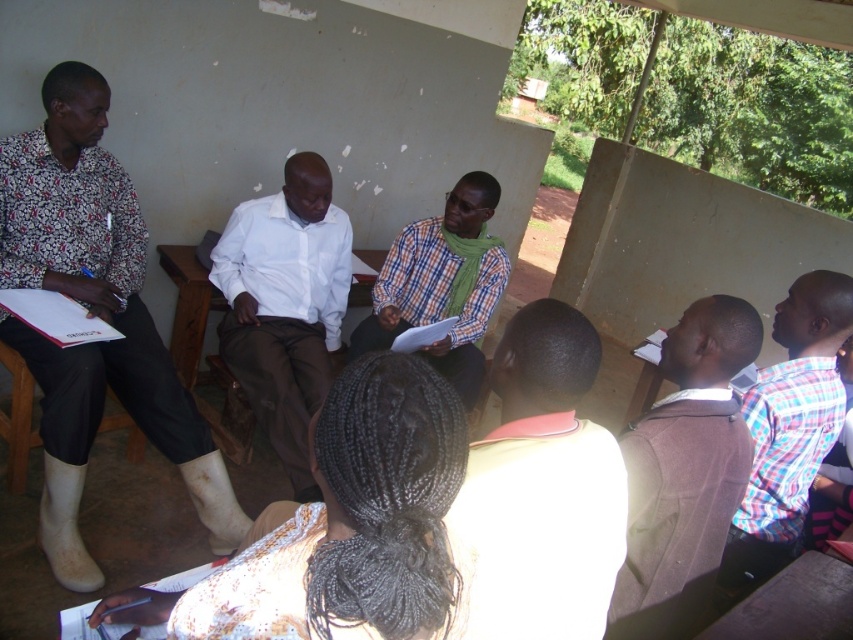
You are organizing a clothing donation drive and need to decide which items will fit into a narrow storage box. Based on the image, which item between the brown woolen sweater at upper right and the plaid fabric shirt at right is more likely to fit into the box due to its size?

The brown woolen sweater at upper right is thinner than the plaid fabric shirt at right, so it is more likely to fit into the narrow storage box.

You are part of the group and need to decide who has a narrower shirt between the plaid fabric shirt at right and the checkered fabric shirt at center. Which one is narrower?

The plaid fabric shirt at right has a lesser width compared to checkpered fabric shirt at center, so the plaid fabric shirt at right is narrower.

In the scene, where exactly is the brown woolen sweater at upper right located in terms of coordinates?

The brown woolen sweater at upper right is located at coordinates point (683,472).